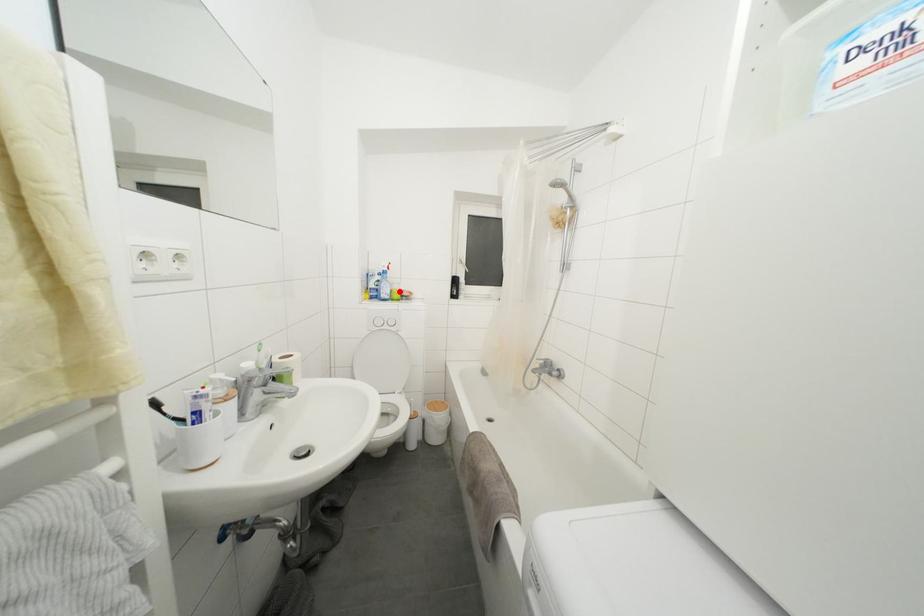
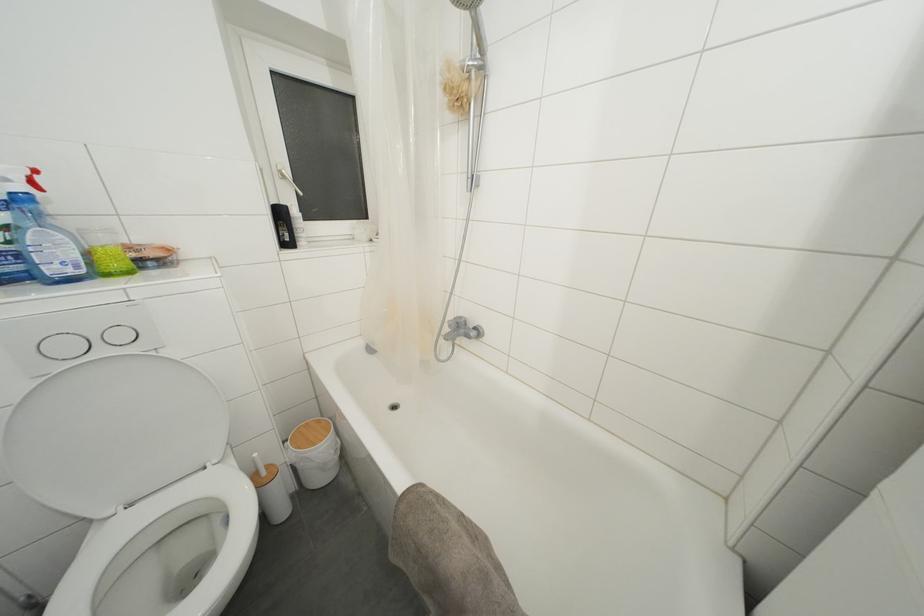
The point at the highlighted location is marked in the first image. Where is the corresponding point in the second image?

(108, 245)